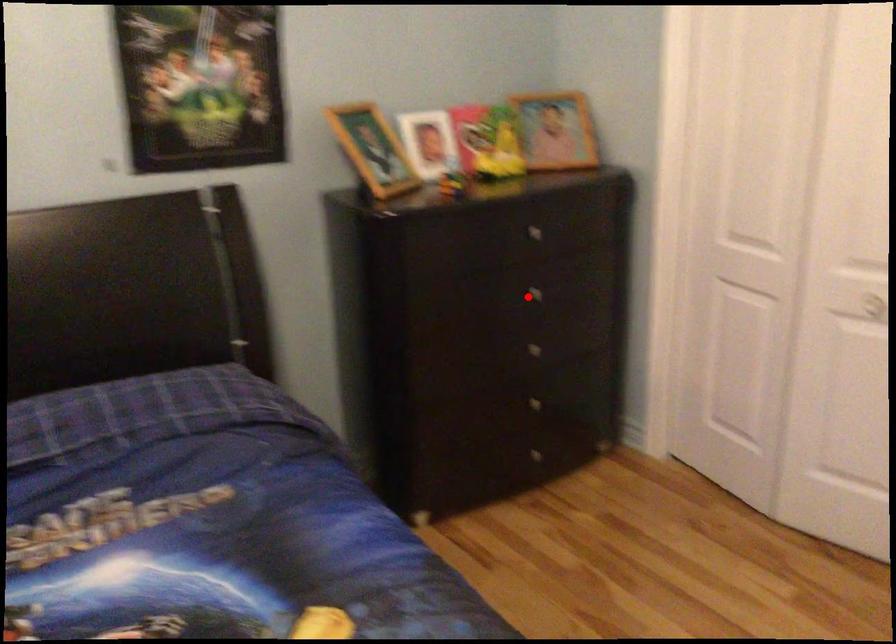
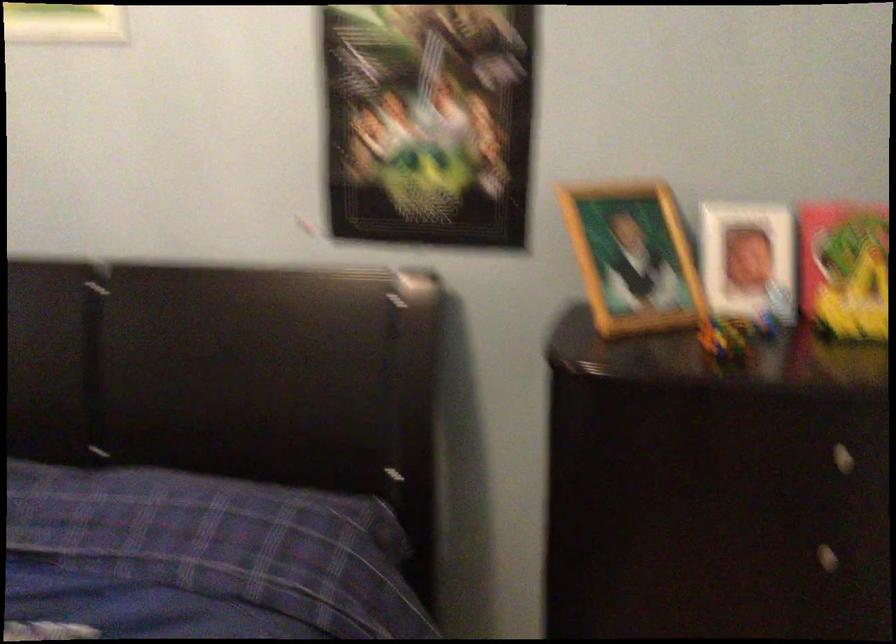
Find the pixel in the second image that matches the highlighted location in the first image.

(807, 554)